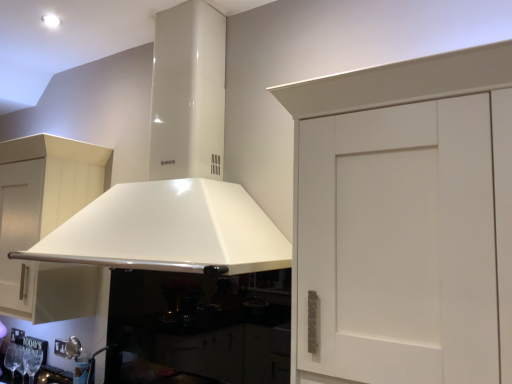
Find the location of a particular element. This screenshot has height=384, width=512. white glossy exhaust hood at center is located at coordinates (177, 174).

Describe the element at coordinates (177, 174) in the screenshot. I see `white glossy exhaust hood at center` at that location.

What do you see at coordinates (46, 224) in the screenshot?
I see `matte white cabinet at left` at bounding box center [46, 224].

Where is `matte white cabinet at left`? The width and height of the screenshot is (512, 384). matte white cabinet at left is located at coordinates (46, 224).

What is the approximate width of matte white cabinet at left?

matte white cabinet at left is 16.04 inches in width.

You are a GUI agent. You are given a task and a screenshot of the screen. Output one action in this format:
    pyautogui.click(x=<x>, y=<y>)
    Task: Click on the white glossy exhaust hood at center
    The image size is (512, 384).
    Given the screenshot: What is the action you would take?
    pyautogui.click(x=177, y=174)

Considering the positions of objects matte white cabinet at left and white glossy exhaust hood at center in the image provided, who is more to the right, matte white cabinet at left or white glossy exhaust hood at center?

white glossy exhaust hood at center.

Looking at this image, does matte white cabinet at left come behind white glossy exhaust hood at center?

Yes, matte white cabinet at left is further from the camera.

Between point (14, 177) and point (169, 205), which one is positioned behind?

The point (14, 177) is farther from the camera.

From the image's perspective, which one is positioned higher, matte white cabinet at left or white glossy exhaust hood at center?

white glossy exhaust hood at center.

From a real-world perspective, which is physically below, matte white cabinet at left or white glossy exhaust hood at center?

matte white cabinet at left, from a real-world perspective.

Does matte white cabinet at left have a lesser width compared to white glossy exhaust hood at center?

Yes, matte white cabinet at left is thinner than white glossy exhaust hood at center.

From their relative heights in the image, would you say matte white cabinet at left is taller or shorter than white glossy exhaust hood at center?

Considering their sizes, matte white cabinet at left has less height than white glossy exhaust hood at center.

Based on the photo, between matte white cabinet at left and white glossy exhaust hood at center, which one has smaller size?

With smaller size is matte white cabinet at left.

Is matte white cabinet at left outside of white glossy exhaust hood at center?

Yes, matte white cabinet at left is outside of white glossy exhaust hood at center.

Does matte white cabinet at left touch white glossy exhaust hood at center?

No, matte white cabinet at left is not next to white glossy exhaust hood at center.

Is matte white cabinet at left facing away from white glossy exhaust hood at center?

matte white cabinet at left does not have its back to white glossy exhaust hood at center.

How much distance is there between matte white cabinet at left and white glossy exhaust hood at center?

The distance of matte white cabinet at left from white glossy exhaust hood at center is 23.37 inches.

This screenshot has width=512, height=384. I want to click on cabinetry located on the left of white glossy exhaust hood at center, so click(x=46, y=224).

Considering the relative positions of white glossy exhaust hood at center and matte white cabinet at left in the image provided, is white glossy exhaust hood at center to the left of matte white cabinet at left from the viewer's perspective?

No, white glossy exhaust hood at center is not to the left of matte white cabinet at left.

Is white glossy exhaust hood at center in front of or behind matte white cabinet at left in the image?

white glossy exhaust hood at center is in front of matte white cabinet at left.

Considering the positions of point (203, 164) and point (39, 155), is point (203, 164) closer or farther from the camera than point (39, 155)?

Point (203, 164).

From the image's perspective, which object appears higher, white glossy exhaust hood at center or matte white cabinet at left?

white glossy exhaust hood at center.

From a real-world perspective, between white glossy exhaust hood at center and matte white cabinet at left, who is vertically lower?

matte white cabinet at left.

Is white glossy exhaust hood at center wider or thinner than matte white cabinet at left?

white glossy exhaust hood at center is wider than matte white cabinet at left.

Considering the sizes of white glossy exhaust hood at center and matte white cabinet at left in the image, is white glossy exhaust hood at center taller or shorter than matte white cabinet at left?

In the image, white glossy exhaust hood at center appears to be taller than matte white cabinet at left.

Considering the sizes of objects white glossy exhaust hood at center and matte white cabinet at left in the image provided, who is bigger, white glossy exhaust hood at center or matte white cabinet at left?

white glossy exhaust hood at center is bigger.

Is white glossy exhaust hood at center inside or outside of matte white cabinet at left?

The correct answer is: outside.

Does white glossy exhaust hood at center touch matte white cabinet at left?

No, white glossy exhaust hood at center is not with matte white cabinet at left.

Could you tell me if white glossy exhaust hood at center is facing matte white cabinet at left?

No.

Looking at this image, measure the distance between white glossy exhaust hood at center and matte white cabinet at left.

They are 23.37 inches apart.

At what (x,y) coordinates should I click in order to perform the action: click on exhaust hood that is above the matte white cabinet at left (from a real-world perspective). Please return your answer as a coordinate pair (x, y). This screenshot has height=384, width=512. Looking at the image, I should click on (177, 174).

Locate an element on the screen. The height and width of the screenshot is (384, 512). exhaust hood lying in front of the matte white cabinet at left is located at coordinates (177, 174).

The width and height of the screenshot is (512, 384). There is a matte white cabinet at left. In order to click on exhaust hood above it (from a real-world perspective) in this screenshot , I will do `click(177, 174)`.